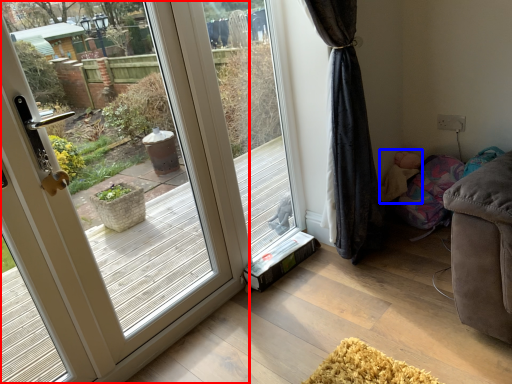
Question: Among these objects, which one is nearest to the camera, door (highlighted by a red box) or child (highlighted by a blue box)?

Choices:
 (A) door
 (B) child

Answer: (A)